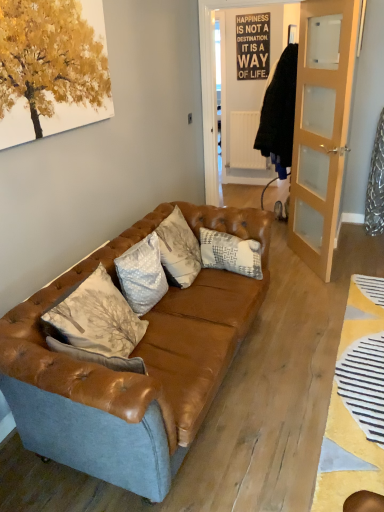
Where is `leather couch at center`? leather couch at center is located at coordinates pyautogui.click(x=134, y=356).

In order to click on light brown wooden door at right in this screenshot , I will do `click(321, 127)`.

Is the surface of leather couch at center in direct contact with light brown wooden door at right?

There is a gap between leather couch at center and light brown wooden door at right.

How different are the orientations of leather couch at center and light brown wooden door at right in degrees?

They differ by 146 degrees in their facing directions.

Between leather couch at center and light brown wooden door at right, which one appears on the left side from the viewer's perspective?

leather couch at center is more to the left.

Considering the relative sizes of leather couch at center and light brown wooden door at right in the image provided, is leather couch at center taller than light brown wooden door at right?

In fact, leather couch at center may be shorter than light brown wooden door at right.

Is leather couch at center thinner than white textured pillow at center, the 2th pillow in the front-to-back sequence?

No.

Does leather couch at center come in front of white textured pillow at center, marked as the 1th pillow in a right-to-left arrangement?

That is True.

Considering the sizes of objects leather couch at center and white textured pillow at center, placed as the second pillow when sorted from left to right, in the image provided, who is taller, leather couch at center or white textured pillow at center, placed as the second pillow when sorted from left to right,?

leather couch at center is taller.

Does leather couch at center turn towards white textured pillow at center, which ranks as the 1th pillow in left-to-right order?

Yes, leather couch at center is aimed at white textured pillow at center, which ranks as the 1th pillow in left-to-right order.

Looking at this image, from a real-world perspective, relative to white textured pillow at center, which ranks as the 1th pillow in left-to-right order, is leather couch at center vertically above or below?

leather couch at center is below white textured pillow at center, which ranks as the 1th pillow in left-to-right order.

Between leather couch at center and white textured pillow at center, which is the 2th pillow from back to front, which one has smaller width?

Thinner between the two is white textured pillow at center, which is the 2th pillow from back to front.

In the scene shown: From the image's perspective, is leather couch at center located above or below white textured pillow at center, which is the 2th pillow in right-to-left order?

leather couch at center is below white textured pillow at center, which is the 2th pillow in right-to-left order.

Where is `pillow that is the 2nd one when counting upward from the leather couch at center (from the image's perspective)`? pillow that is the 2nd one when counting upward from the leather couch at center (from the image's perspective) is located at coordinates (230, 253).

Is white textured pillow at center, arranged as the 1th pillow when viewed from the back, further to the viewer compared to leather couch at center?

Yes, it is behind leather couch at center.

Based on the photo, from the image's perspective, is white textured pillow at center, the 2th pillow in the front-to-back sequence, under leather couch at center?

No, from the image's perspective, white textured pillow at center, the 2th pillow in the front-to-back sequence, is not below leather couch at center.

Based on their positions, is white textured pillow at center, marked as the 1th pillow in a right-to-left arrangement, located to the left or right of leather couch at center?

Clearly, white textured pillow at center, marked as the 1th pillow in a right-to-left arrangement, is on the right of leather couch at center in the image.

Which is closer, (x=148, y=275) or (x=224, y=274)?

The point (x=148, y=275) is more forward.

How many degrees apart are the facing directions of white textured pillow at center, positioned as the first pillow in front-to-back order, and leather couch at center?

There is a 1.55-degree angle between the facing directions of white textured pillow at center, positioned as the first pillow in front-to-back order, and leather couch at center.

The width and height of the screenshot is (384, 512). What are the coordinates of `pillow that appears on the left of leather couch at center` in the screenshot? It's located at (142, 275).

Is white textured pillow at center, which is the 2th pillow from back to front, facing away from leather couch at center?

Yes, white textured pillow at center, which is the 2th pillow from back to front, is positioned with its back facing leather couch at center.

Is light brown wooden door at right further to the viewer compared to leather couch at center?

Yes, it is behind leather couch at center.

Between point (320, 153) and point (175, 376), which one is positioned behind?

Point (320, 153)

Image resolution: width=384 pixels, height=512 pixels. In order to click on studio couch in front of the light brown wooden door at right in this screenshot , I will do `click(134, 356)`.

Considering the positions of point (219, 243) and point (334, 42), is point (219, 243) closer or farther from the camera than point (334, 42)?

Clearly, point (219, 243) is closer to the camera than point (334, 42).

From a real-world perspective, is white textured pillow at center, placed as the second pillow when sorted from left to right, positioned under light brown wooden door at right based on gravity?

Yes, from a real-world perspective, white textured pillow at center, placed as the second pillow when sorted from left to right, is under light brown wooden door at right.

Identify the location of door above the white textured pillow at center, arranged as the 1th pillow when viewed from the back (from a real-world perspective). This screenshot has width=384, height=512. (321, 127).

Where is `door above the leather couch at center (from the image's perspective)`? door above the leather couch at center (from the image's perspective) is located at coordinates (321, 127).

The image size is (384, 512). What are the coordinates of `pillow that is the 1st object above the leather couch at center (from a real-world perspective)` in the screenshot? It's located at (230, 253).

Considering their positions, is white textured pillow at center, marked as the 1th pillow in a right-to-left arrangement, positioned closer to light brown wooden door at right than leather couch at center?

white textured pillow at center, marked as the 1th pillow in a right-to-left arrangement, is closer to light brown wooden door at right.

Which object lies further to the anchor point leather couch at center, light brown wooden door at right or white textured pillow at center, which ranks as the 1th pillow in left-to-right order?

Based on the image, light brown wooden door at right appears to be further to leather couch at center.

From the picture: From the image, which object appears to be farther from white textured pillow at center, which ranks as the 1th pillow in left-to-right order, white textured pillow at center, arranged as the 1th pillow when viewed from the back, or light brown wooden door at right?

Among the two, light brown wooden door at right is located further to white textured pillow at center, which ranks as the 1th pillow in left-to-right order.

From the image, which object appears to be farther from white textured pillow at center, arranged as the 1th pillow when viewed from the back, white textured pillow at center, positioned as the first pillow in front-to-back order, or leather couch at center?

leather couch at center is positioned further to the anchor white textured pillow at center, arranged as the 1th pillow when viewed from the back.

Which object lies nearer to the anchor point white textured pillow at center, which is the 2th pillow in right-to-left order, leather couch at center or light brown wooden door at right?

leather couch at center is positioned closer to the anchor white textured pillow at center, which is the 2th pillow in right-to-left order.

Estimate the real-world distances between objects in this image. Which object is closer to light brown wooden door at right, white textured pillow at center, which is the 2th pillow in right-to-left order, or leather couch at center?

leather couch at center.

Looking at the image, which one is located further to white textured pillow at center, positioned as the first pillow in front-to-back order, light brown wooden door at right or leather couch at center?

Based on the image, light brown wooden door at right appears to be further to white textured pillow at center, positioned as the first pillow in front-to-back order.

Which object lies further to the anchor point white textured pillow at center, the 2th pillow in the front-to-back sequence, leather couch at center or light brown wooden door at right?

light brown wooden door at right is positioned further to the anchor white textured pillow at center, the 2th pillow in the front-to-back sequence.

This screenshot has width=384, height=512. Find the location of `pillow located between white textured pillow at center, positioned as the first pillow in front-to-back order, and light brown wooden door at right in the left-right direction`. pillow located between white textured pillow at center, positioned as the first pillow in front-to-back order, and light brown wooden door at right in the left-right direction is located at coordinates (230, 253).

You are a GUI agent. You are given a task and a screenshot of the screen. Output one action in this format:
    pyautogui.click(x=<x>, y=<y>)
    Task: Click on the studio couch between white textured pillow at center, which is the 2th pillow from back to front, and light brown wooden door at right, in the horizontal direction
    
    Given the screenshot: What is the action you would take?
    pyautogui.click(x=134, y=356)

Identify the location of pillow between leather couch at center and white textured pillow at center, marked as the 1th pillow in a right-to-left arrangement, in the front-back direction. (142, 275).

Locate an element on the screen. The height and width of the screenshot is (512, 384). door located between leather couch at center and white textured pillow at center, marked as the 1th pillow in a right-to-left arrangement, in the depth direction is located at coordinates (321, 127).